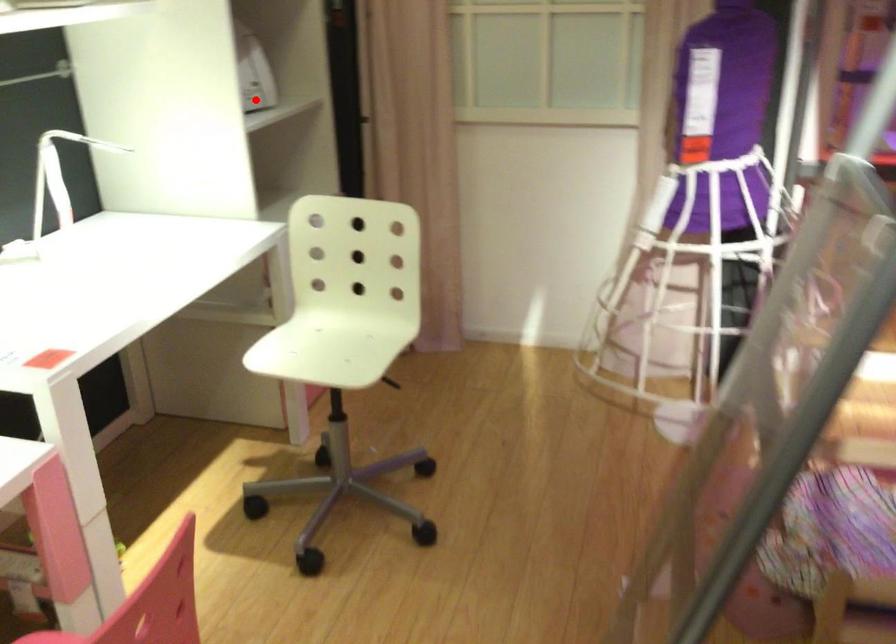
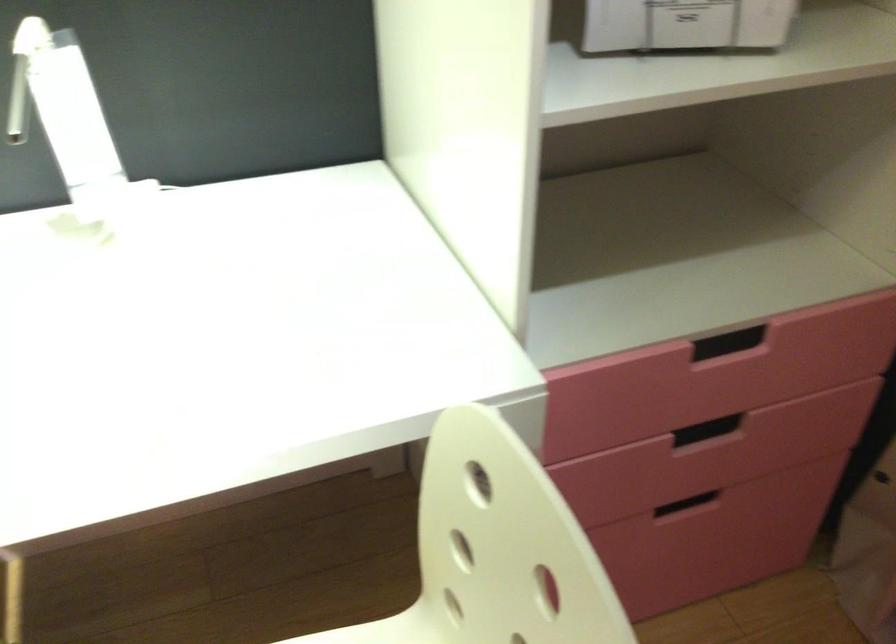
Question: I am providing you with two images of the same scene from different viewpoints. Given a red point in image1, look at the same physical point in image2. Is it:

Choices:
 (A) Closer to the viewpoint
 (B) Farther from the viewpoint

Answer: (A)